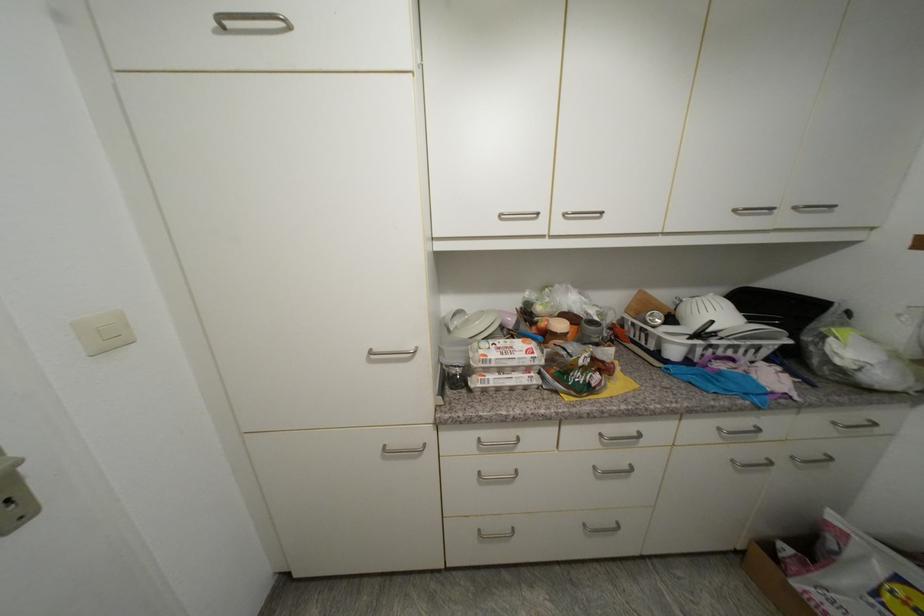
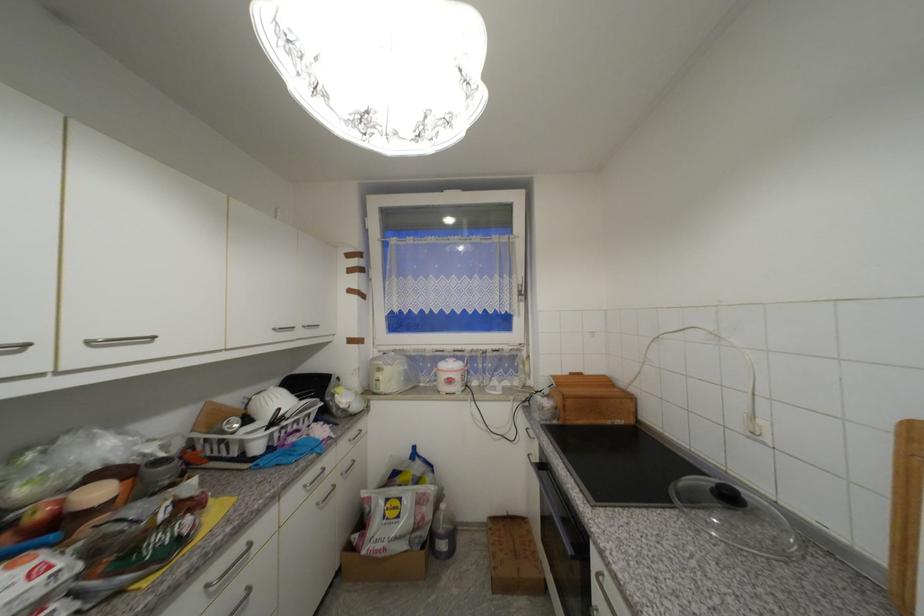
Find the pixel in the second image that matches (x=548, y=325) in the first image.

(44, 517)